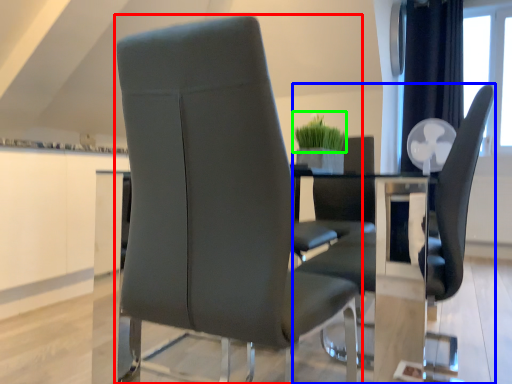
Question: Considering the real-world distances, which object is closest to chair (highlighted by a red box)? chair (highlighted by a blue box) or plant (highlighted by a green box).

Choices:
 (A) chair
 (B) plant

Answer: (A)